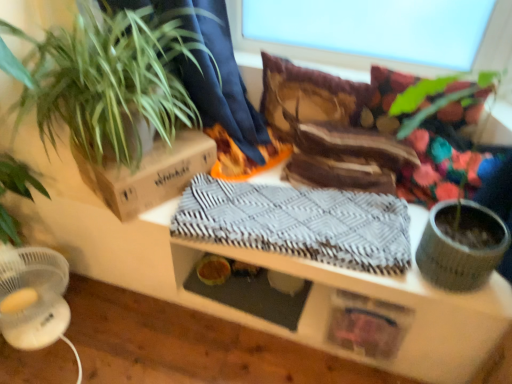
Question: Is gray woven blanket at center looking in the opposite direction of textured wood table at center?

Choices:
 (A) no
 (B) yes

Answer: (B)

Question: Does gray woven blanket at center come in front of textured wood table at center?

Choices:
 (A) yes
 (B) no

Answer: (B)

Question: Can you confirm if gray woven blanket at center is bigger than textured wood table at center?

Choices:
 (A) yes
 (B) no

Answer: (B)

Question: Is gray woven blanket at center smaller than textured wood table at center?

Choices:
 (A) yes
 (B) no

Answer: (A)

Question: Does gray woven blanket at center have a lesser height compared to textured wood table at center?

Choices:
 (A) no
 (B) yes

Answer: (A)

Question: Do you think transparent glass window screen at upper center is within green leafy plant at left, or outside of it?

Choices:
 (A) inside
 (B) outside

Answer: (B)

Question: From a real-world perspective, is transparent glass window screen at upper center positioned above or below green leafy plant at left?

Choices:
 (A) below
 (B) above

Answer: (B)

Question: In the image, is transparent glass window screen at upper center positioned in front of or behind green leafy plant at left?

Choices:
 (A) front
 (B) behind

Answer: (B)

Question: From the image's perspective, is transparent glass window screen at upper center positioned above or below green leafy plant at left?

Choices:
 (A) above
 (B) below

Answer: (A)

Question: Is gray woven blanket at center inside or outside of textured wood table at center?

Choices:
 (A) inside
 (B) outside

Answer: (A)

Question: In terms of width, does gray woven blanket at center look wider or thinner when compared to textured wood table at center?

Choices:
 (A) wide
 (B) thin

Answer: (B)

Question: Is point (244, 200) closer or farther from the camera than point (414, 238)?

Choices:
 (A) farther
 (B) closer

Answer: (A)

Question: From the image's perspective, relative to textured wood table at center, is gray woven blanket at center above or below?

Choices:
 (A) above
 (B) below

Answer: (B)

Question: Based on their sizes in the image, would you say brown cardboard box at upper left is bigger or smaller than gray woven blanket at center?

Choices:
 (A) small
 (B) big

Answer: (A)

Question: From the image's perspective, is brown cardboard box at upper left located above or below gray woven blanket at center?

Choices:
 (A) below
 (B) above

Answer: (B)